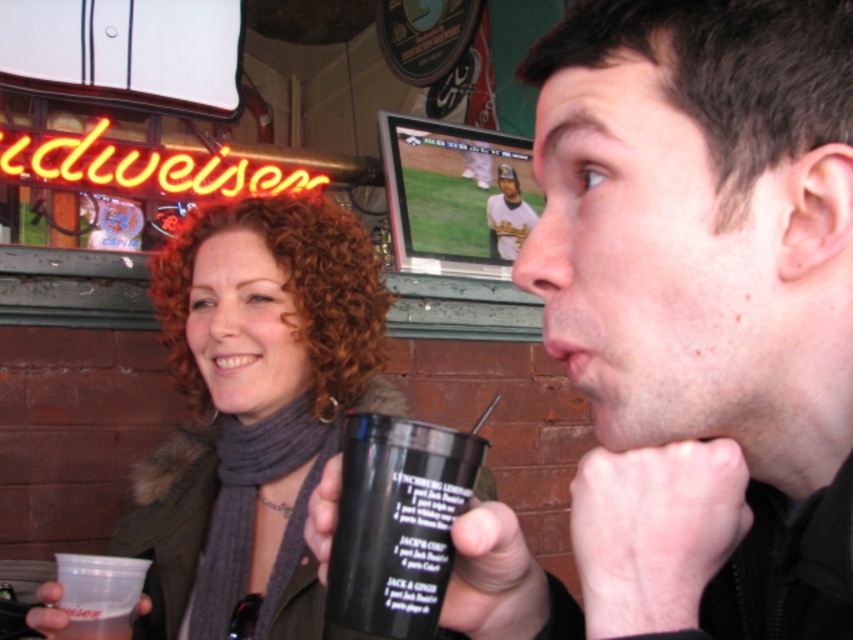
You are a bartender who needs to place two cups on a shelf that is 30 inches wide. The cups are the matte black cup at center and the black plastic cup at lower center. Can both cups fit side by side on the shelf without overlapping?

The matte black cup at center is 31.10 inches from the black plastic cup at lower center. Since the distance between them is greater than the shelf width of 30 inches, placing them side by side would require adjusting their positions to fit within the shelf space.

You are at a bar and want to order a drink. You see a matte black cup at right and a white jersey baseball player at upper center. Which object is closer to the left side of the bar?

The matte black cup at right is to the left of the white jersey baseball player at upper center, so it is closer to the left side of the bar.